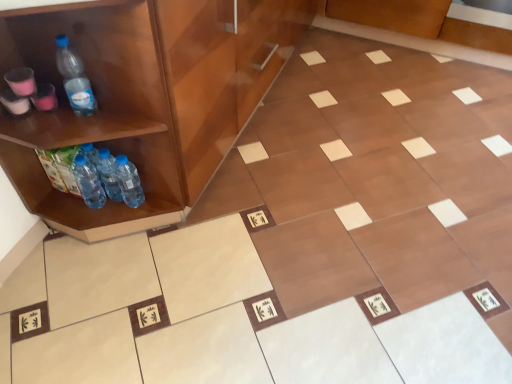
Where is `free space in front of brown glossy cabinet at left`? The image size is (512, 384). free space in front of brown glossy cabinet at left is located at coordinates (272, 259).